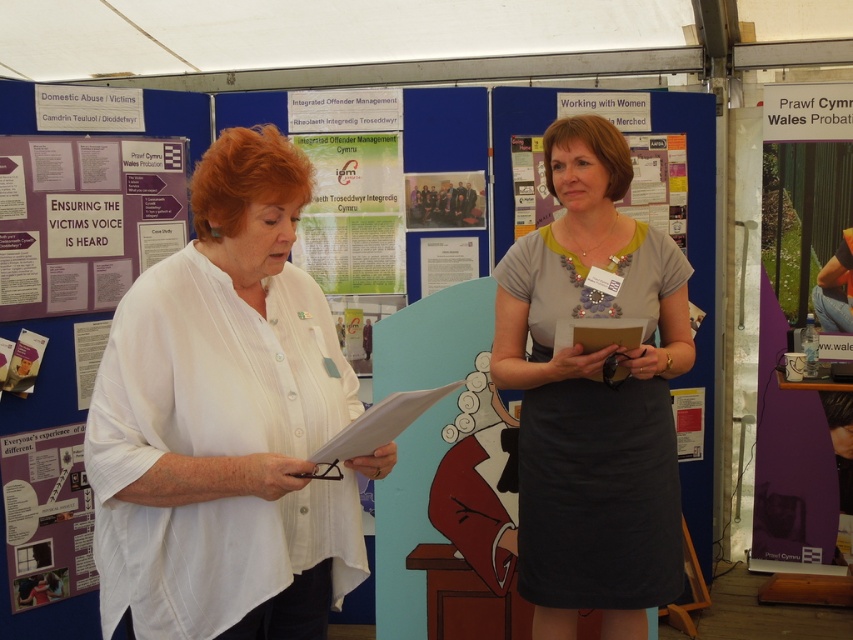
You are observing two purple papers in the scene. Which one is taller between the purple paper at lower left and the purple paper at upper left?

The purple paper at lower left is much taller than the purple paper at upper left according to the description.

You are a photographer at the event and need to capture a clear photo of both the white matte shirt at center and the purple paper at upper left. Which object should you focus on first to ensure both are in focus?

The white matte shirt at center is larger in size than the purple paper at upper left, so you should focus on the white matte shirt at center first to ensure both are in focus.

You are standing in front of the conference booth and notice the white matte shirt at center and the purple paper at upper left. Which object is located to the right of the other?

The white matte shirt at center is positioned on the right side of purple paper at upper left.